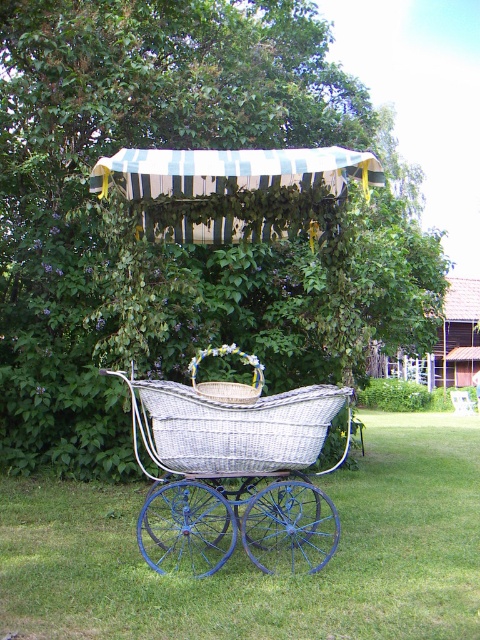
Question: Is white wicker carriage at center below woven wicker baby carriage at center?

Choices:
 (A) no
 (B) yes

Answer: (B)

Question: Which object appears farthest from the camera in this image?

Choices:
 (A) woven straw basket at center
 (B) green leafy tree at center
 (C) green striped fabric canopy at upper center
 (D) woven wicker baby carriage at center

Answer: (B)

Question: Which object is positioned farthest from the woven straw basket at center?

Choices:
 (A) green striped fabric canopy at upper center
 (B) woven wicker baby carriage at center
 (C) white wicker carriage at center

Answer: (C)

Question: Is green leafy tree at center above woven wicker baby carriage at center?

Choices:
 (A) no
 (B) yes

Answer: (B)

Question: Is white wicker carriage at center to the right of woven straw basket at center from the viewer's perspective?

Choices:
 (A) yes
 (B) no

Answer: (A)

Question: Which of these objects is positioned farthest from the woven straw basket at center?

Choices:
 (A) white wicker carriage at center
 (B) green striped fabric canopy at upper center
 (C) woven wicker baby carriage at center
 (D) green leafy tree at center

Answer: (D)